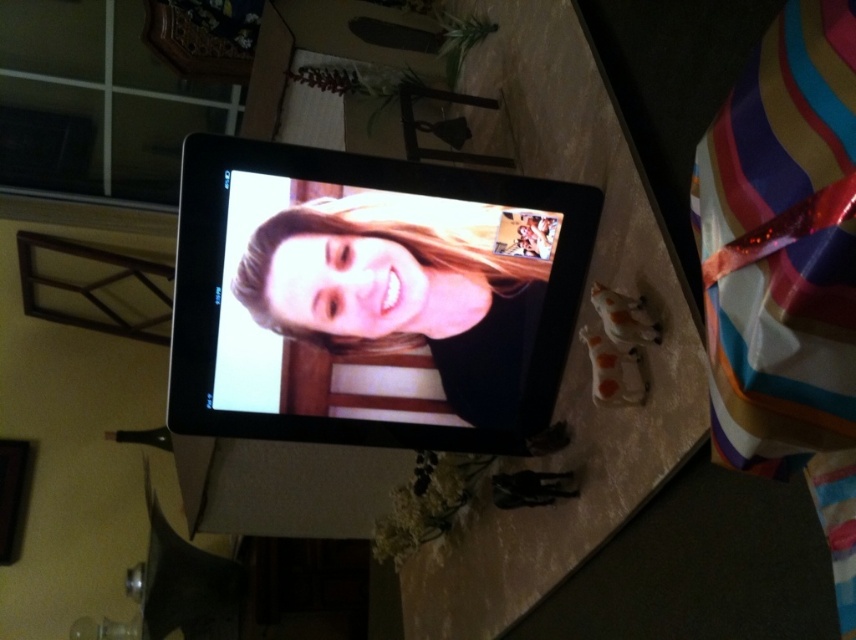
You are setting up a video call on a tablet. You notice two objects on the screen. The first is the matte black screen at center, and the second is the matte skin face at center. Which of these two objects appears taller in the image?

The matte black screen at center is much taller as the matte skin face at center.

You are setting up a video call and want to ensure both the matte black screen at center and the matte skin face at center are visible. Which object is positioned lower on the screen?

The matte black screen at center is positioned below the matte skin face at center, so it is lower on the screen.

You are setting up a video call and need to adjust the tablet so both the matte black screen at center and the matte skin face at center are visible. Which object should you move to the left to make space?

The matte black screen at center is to the right of the matte skin face at center. To make space, move the matte black screen at center to the left so both can be visible.